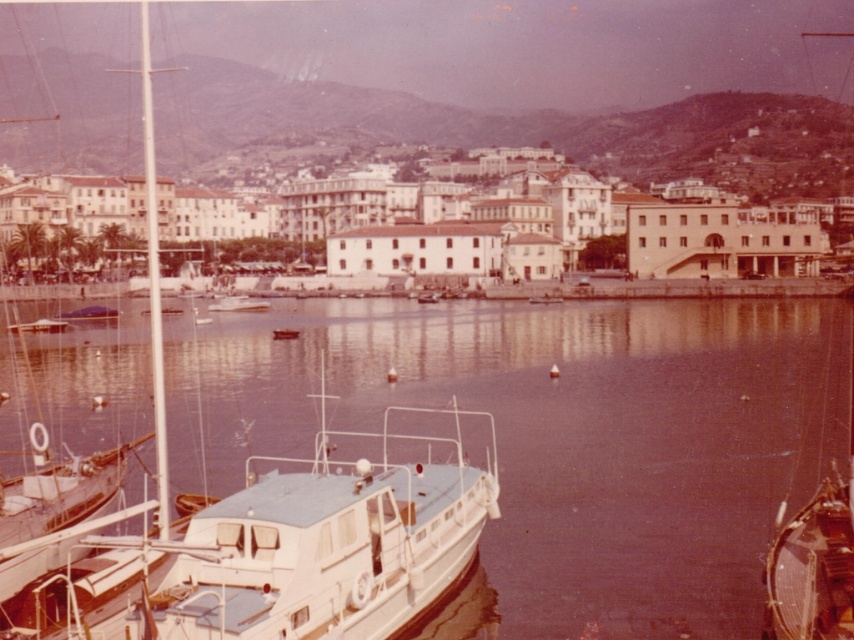
Can you confirm if clear water at center is taller than white glossy boat at center?

Yes.

Can you confirm if clear water at center is positioned to the left of white glossy boat at center?

In fact, clear water at center is to the right of white glossy boat at center.

Find the location of a particular element. The image size is (854, 640). clear water at center is located at coordinates (554, 438).

The image size is (854, 640). Find the location of `clear water at center`. clear water at center is located at coordinates (554, 438).

Does white glossy boat at left have a lesser width compared to wooden polished boat at lower right?

Incorrect, white glossy boat at left's width is not less than wooden polished boat at lower right's.

Which is behind, point (19, 541) or point (828, 515)?

Positioned behind is point (828, 515).

Describe the element at coordinates (155, 454) in the screenshot. This screenshot has height=640, width=854. I see `white glossy boat at left` at that location.

Identify the location of white glossy boat at left. This screenshot has height=640, width=854. (155, 454).

In the scene shown: Can you confirm if clear water at center is positioned to the left of wooden polished boat at lower right?

Correct, you'll find clear water at center to the left of wooden polished boat at lower right.

Is clear water at center in front of wooden polished boat at lower right?

No, clear water at center is behind wooden polished boat at lower right.

Identify the location of clear water at center. (554, 438).